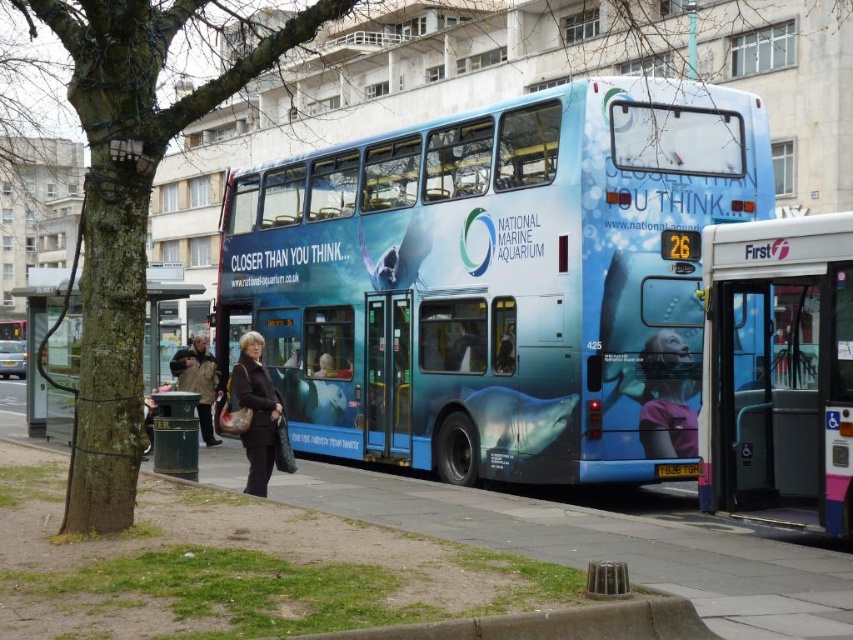
Is blue glossy bus at center closer to the viewer compared to black plastic license plate at center?

That is True.

Can you confirm if blue glossy bus at center is thinner than black plastic license plate at center?

In fact, blue glossy bus at center might be wider than black plastic license plate at center.

Is point (543, 438) closer to viewer compared to point (660, 474)?

No, it is not.

The height and width of the screenshot is (640, 853). Identify the location of blue glossy bus at center. (497, 280).

Who is more distant from viewer, (746,513) or (33,432)?

Point (33,432)

Between blue metallic bus at center and green plastic trash can at left, which one is positioned higher?

Positioned higher is green plastic trash can at left.

Does point (817, 241) come behind point (42, 355)?

No.

At what (x,y) coordinates should I click in order to perform the action: click on blue metallic bus at center. Please return your answer as a coordinate pair (x, y). Looking at the image, I should click on (x=778, y=372).

Can you confirm if blue metallic bus at center is smaller than brown leather jacket at center?

Yes, blue metallic bus at center is smaller than brown leather jacket at center.

Who is taller, blue metallic bus at center or brown leather jacket at center?

brown leather jacket at center is taller.

Is point (753, 452) positioned behind point (202, 380)?

No, (753, 452) is in front of (202, 380).

I want to click on blue metallic bus at center, so click(x=778, y=372).